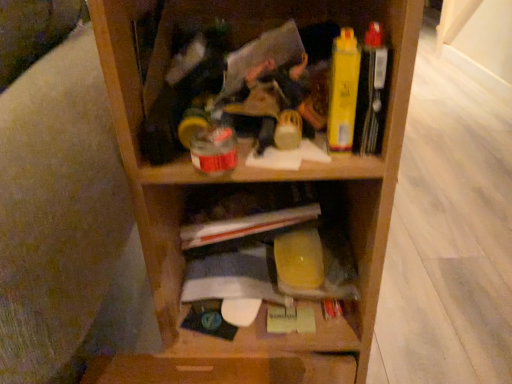
Question: Considering the positions of point (x=176, y=210) and point (x=330, y=213), is point (x=176, y=210) closer or farther from the camera than point (x=330, y=213)?

Choices:
 (A) closer
 (B) farther

Answer: (A)

Question: From the image's perspective, is yellow plastic container at center above or below wooden shelf at center?

Choices:
 (A) above
 (B) below

Answer: (B)

Question: Estimate the real-world distances between objects in this image. Which object is closer to the yellow matte book at upper right?

Choices:
 (A) wooden shelf at center
 (B) yellow plastic container at center

Answer: (A)

Question: Which object is the farthest from the wooden shelf at center?

Choices:
 (A) yellow plastic container at center
 (B) yellow matte book at upper right

Answer: (B)